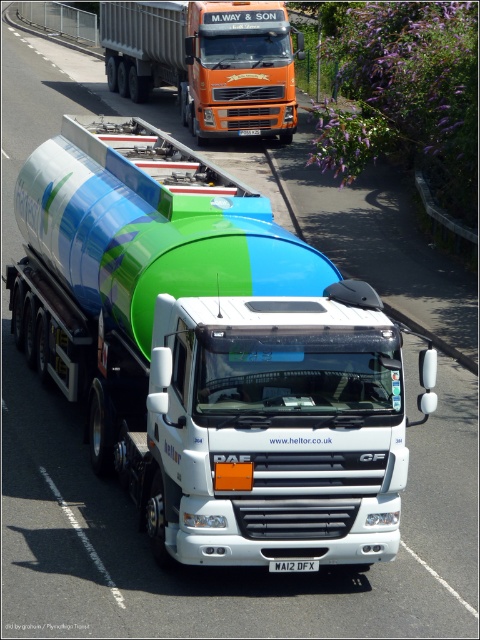
You are a delivery driver who needs to park your truck at a specific spot marked at coordinates 0.553, 0.435. You see the green matte tanker at center in your view. Where should you park your truck?

The green matte tanker at center is already located at the coordinates (208,353), so you should park your truck in a different spot to avoid blocking it.

You are a pedestrian standing on the sidewalk observing the road scene. You see the green matte tanker at center and the orange metallic truck at upper center. Which truck is positioned to the right side from your viewpoint?

The green matte tanker at center is positioned to the right of the orange metallic truck at upper center from your viewpoint.

You are a delivery driver planning to overtake the white DAF CF truck with a large cylindrical tank trailer attached. There are two points marked on the road ahead. One is at coordinate point (223, 412) and the other at point (137, 76). According to the image, which point should you aim for to safely overtake the truck?

You should aim for point (223, 412) because it is in front of point (137, 76), allowing you to overtake the white DAF CF truck with a large cylindrical tank trailer attached safely.